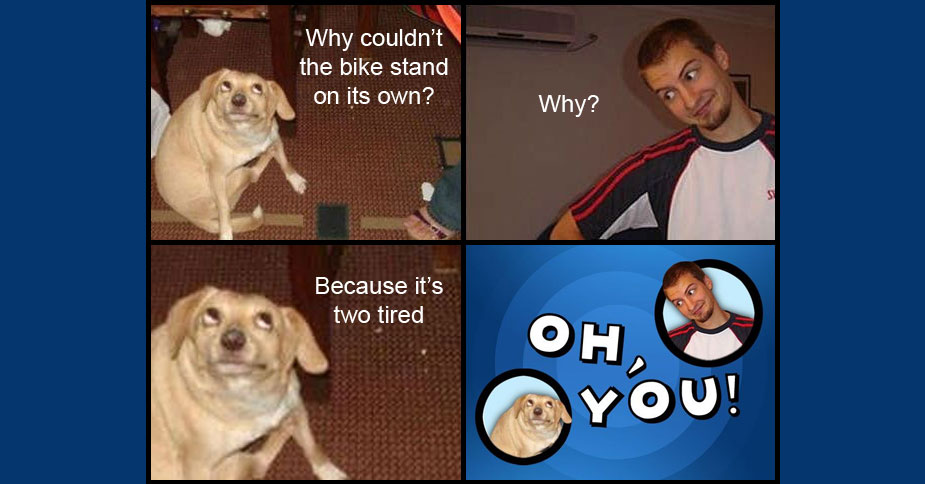
Locate an element on the screen. hanging picture is located at coordinates (740, 80).